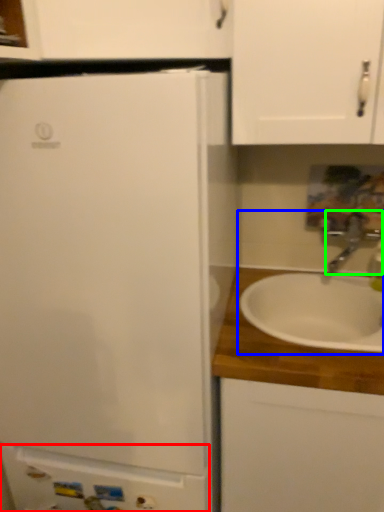
Question: Which object is positioned closest to cabinetry (highlighted by a red box)? Select from sink (highlighted by a blue box) and tap (highlighted by a green box).

Choices:
 (A) sink
 (B) tap

Answer: (A)